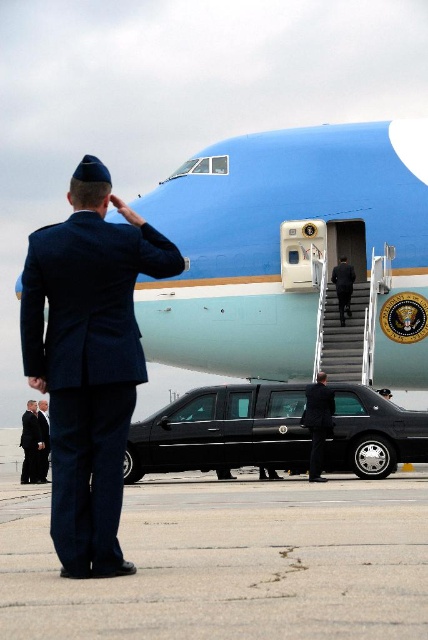
You are a photographer at the airport tarmac. You need to capture a photo of the black suit at lower left. Where exactly should you position your camera to get the best shot?

The black suit at lower left is located at point (x=32, y=444), so position your camera at that coordinate for the best shot.

You are a photographer at the airport and need to capture a photo of the black glossy limousine at center. The limousine is located at point (222, 432). Where should you position your camera to ensure the limousine is centered in the photo?

The black glossy limousine at center is already located at point (222, 432), which is the center of the image. Therefore, positioning the camera directly facing the limousine will ensure it remains centered in the photo.